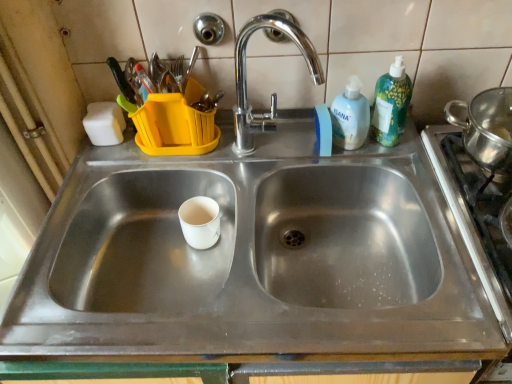
Question: Is white plastic bottle at upper right, the 1th cleaning product when ordered from left to right, at the back of stainless steel gas stove at right?

Choices:
 (A) yes
 (B) no

Answer: (B)

Question: Can you confirm if stainless steel gas stove at right is shorter than white plastic bottle at upper right, the 1th cleaning product when ordered from left to right?

Choices:
 (A) no
 (B) yes

Answer: (A)

Question: Can you confirm if stainless steel gas stove at right is bigger than white plastic bottle at upper right, the 1th cleaning product when ordered from left to right?

Choices:
 (A) yes
 (B) no

Answer: (A)

Question: Does stainless steel gas stove at right have a greater width compared to white plastic bottle at upper right, marked as the 2th cleaning product in a right-to-left arrangement?

Choices:
 (A) no
 (B) yes

Answer: (B)

Question: Is stainless steel gas stove at right in contact with white plastic bottle at upper right, marked as the 2th cleaning product in a right-to-left arrangement?

Choices:
 (A) yes
 (B) no

Answer: (B)

Question: From a real-world perspective, is stainless steel gas stove at right located beneath white plastic bottle at upper right, marked as the 2th cleaning product in a right-to-left arrangement?

Choices:
 (A) no
 (B) yes

Answer: (B)

Question: Is stainless steel gas stove at right positioned in front of white matte paper cup at center?

Choices:
 (A) yes
 (B) no

Answer: (A)

Question: Is white matte paper cup at center completely or partially inside stainless steel gas stove at right?

Choices:
 (A) yes
 (B) no

Answer: (B)

Question: Could you tell me if stainless steel gas stove at right is facing white matte paper cup at center?

Choices:
 (A) yes
 (B) no

Answer: (B)

Question: From a real-world perspective, is stainless steel gas stove at right beneath white matte paper cup at center?

Choices:
 (A) yes
 (B) no

Answer: (B)

Question: Can you confirm if stainless steel gas stove at right is bigger than white matte paper cup at center?

Choices:
 (A) yes
 (B) no

Answer: (A)

Question: Is stainless steel gas stove at right next to white matte paper cup at center and touching it?

Choices:
 (A) no
 (B) yes

Answer: (A)

Question: Does white matte paper cup at center have a lesser height compared to white plastic bottle at upper right, the 1th cleaning product when ordered from left to right?

Choices:
 (A) no
 (B) yes

Answer: (B)